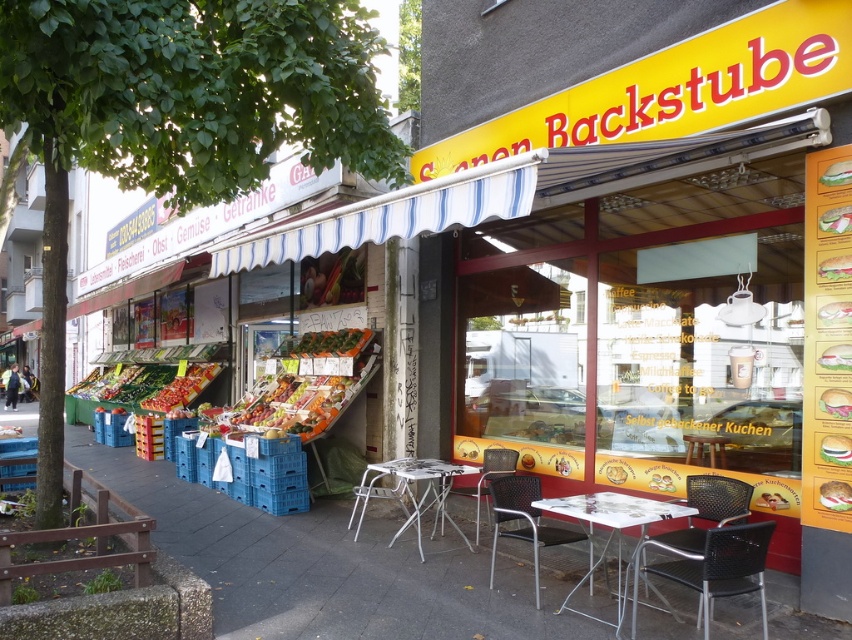
Question: Is the position of white plastic table at center more distant than that of black plastic chair at center?

Choices:
 (A) no
 (B) yes

Answer: (B)

Question: Which of the following is the closest to the observer?

Choices:
 (A) (640, 563)
 (B) (301, 346)

Answer: (A)

Question: Is white plastic table at center positioned before brown woven chair at center?

Choices:
 (A) yes
 (B) no

Answer: (A)

Question: Which point appears closest to the camera in this image?

Choices:
 (A) (251, 563)
 (B) (629, 497)
 (C) (334, 353)
 (D) (475, 525)

Answer: (B)

Question: Does white plastic table at lower center have a lesser width compared to white plastic table at center?

Choices:
 (A) no
 (B) yes

Answer: (B)

Question: Which point appears farthest from the camera in this image?

Choices:
 (A) (327, 349)
 (B) (573, 536)
 (C) (399, 468)

Answer: (A)